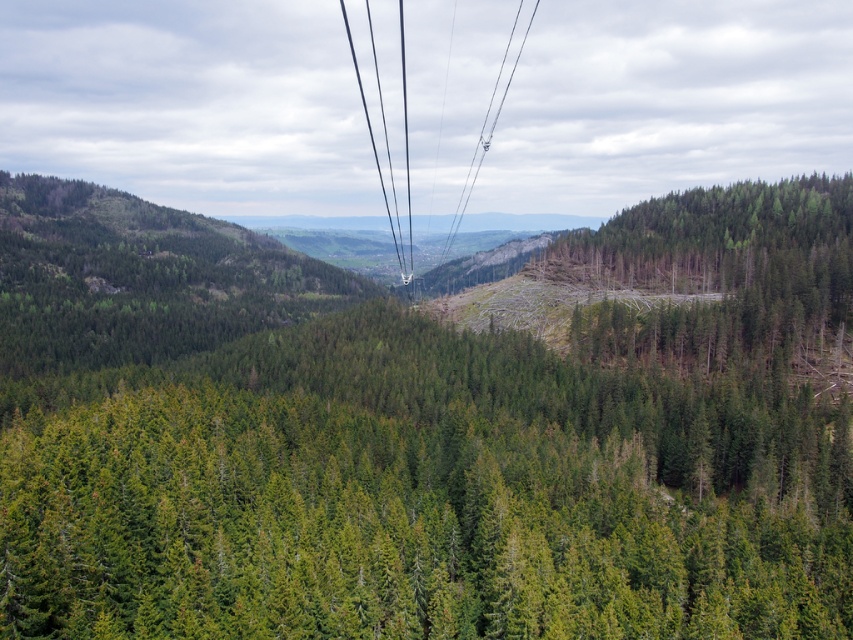
Between green matte forest at center and metallic wire at center, which one appears on the right side from the viewer's perspective?

metallic wire at center is more to the right.

Who is more forward, (300, 520) or (465, 198)?

Point (300, 520)

At what (x,y) coordinates should I click in order to perform the action: click on green matte forest at center. Please return your answer as a coordinate pair (x, y). Looking at the image, I should click on point(393,451).